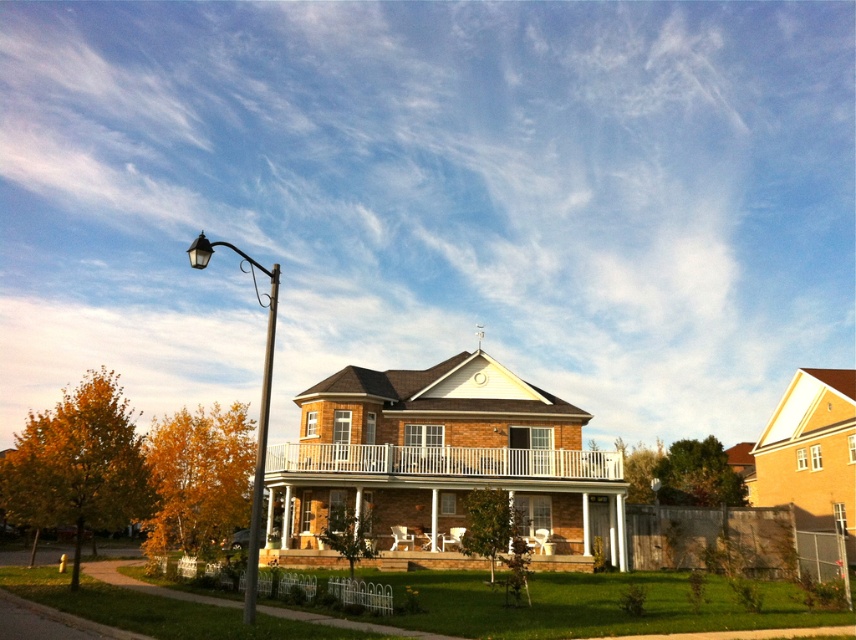
Question: Among these objects, which one is nearest to the camera?

Choices:
 (A) polished metal street light at left
 (B) white painted wood balcony at center
 (C) metallic pole at left

Answer: (C)

Question: Which point is closer to the camera?

Choices:
 (A) (580, 468)
 (B) (268, 371)
 (C) (248, 584)

Answer: (C)

Question: Is polished metal street light at left smaller than metallic pole at left?

Choices:
 (A) yes
 (B) no

Answer: (B)

Question: Which of these objects is positioned farthest from the white painted wood balcony at center?

Choices:
 (A) metallic pole at left
 (B) polished metal street light at left

Answer: (B)

Question: Is white painted wood balcony at center positioned before polished metal street light at left?

Choices:
 (A) yes
 (B) no

Answer: (B)

Question: Is polished metal street light at left to the left of metallic pole at left from the viewer's perspective?

Choices:
 (A) yes
 (B) no

Answer: (A)